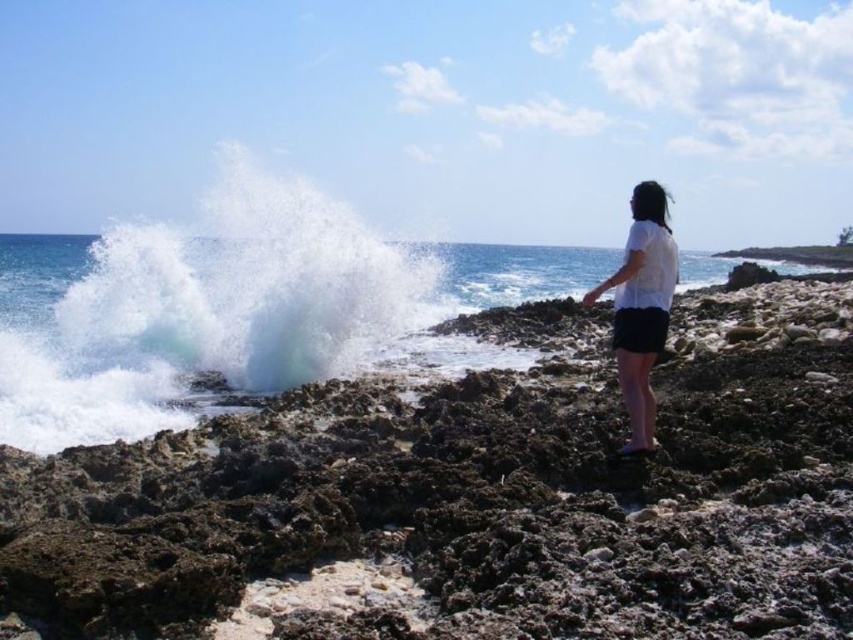
You are a geologist examining the coastal area shown. You need to locate the rough textured rocks at center. According to the coordinates provided, where exactly would you find them?

The rough textured rocks at center are located at point (x=480, y=492).